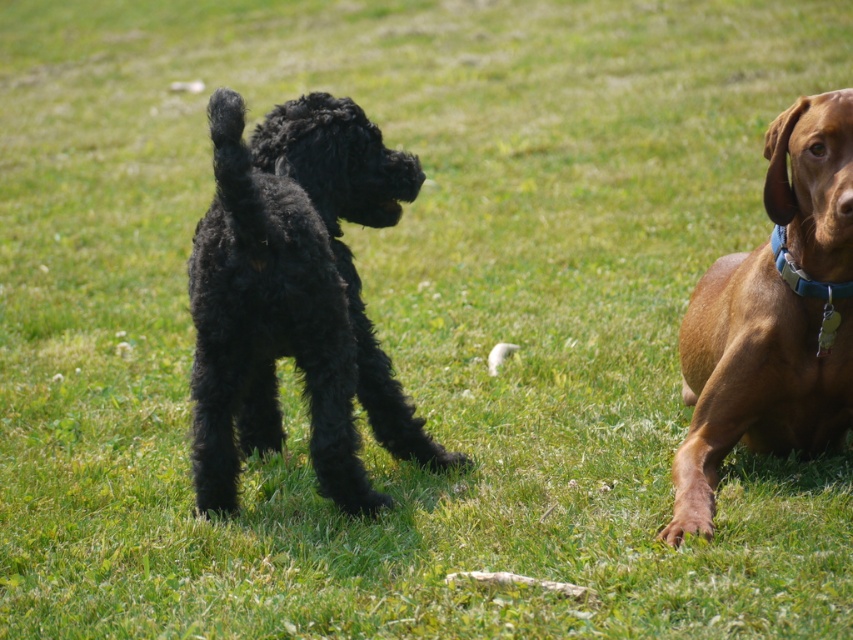
Can you confirm if black fluffy dog at center is smaller than brown smooth dog at right?

No, black fluffy dog at center is not smaller than brown smooth dog at right.

Between point (360, 164) and point (672, 538), which one is positioned in front?

Point (672, 538)

This screenshot has height=640, width=853. I want to click on black fluffy dog at center, so pos(294,296).

Which is in front, point (782, 284) or point (776, 232)?

Point (782, 284)

The height and width of the screenshot is (640, 853). Describe the element at coordinates (773, 317) in the screenshot. I see `brown smooth dog at right` at that location.

Where is `brown smooth dog at right`? Image resolution: width=853 pixels, height=640 pixels. brown smooth dog at right is located at coordinates (773, 317).

Can you confirm if black fluffy dog at center is positioned above blue fabric collar at right?

No, black fluffy dog at center is not above blue fabric collar at right.

Can you confirm if black fluffy dog at center is positioned below blue fabric collar at right?

Yes, black fluffy dog at center is below blue fabric collar at right.

Which is behind, point (224, 332) or point (791, 262)?

Positioned behind is point (791, 262).

Where is `black fluffy dog at center`? black fluffy dog at center is located at coordinates (294, 296).